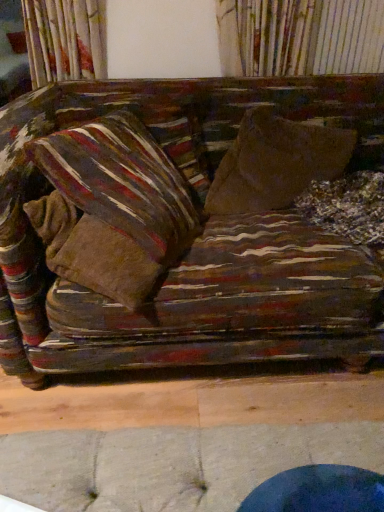
Question: Is striped fabric pillow at left, the 2th pillow when ordered from back to front, taller than striped fabric pillow at upper left, arranged as the first pillow when viewed from the back?

Choices:
 (A) yes
 (B) no

Answer: (A)

Question: Can you confirm if striped fabric pillow at left, the 1th pillow viewed from the front, is wider than striped fabric pillow at upper left, the 2th pillow positioned from the front?

Choices:
 (A) no
 (B) yes

Answer: (A)

Question: Is striped fabric pillow at left, the 2th pillow when ordered from back to front, next to striped fabric pillow at upper left, the 2th pillow positioned from the front, and touching it?

Choices:
 (A) no
 (B) yes

Answer: (A)

Question: From a real-world perspective, is striped fabric pillow at left, the 2th pillow when ordered from back to front, located higher than striped fabric pillow at upper left, the 2th pillow positioned from the front?

Choices:
 (A) no
 (B) yes

Answer: (B)

Question: Is striped fabric pillow at left, the 2th pillow when ordered from back to front, facing away from striped fabric pillow at upper left, arranged as the first pillow when viewed from the back?

Choices:
 (A) no
 (B) yes

Answer: (B)

Question: Considering the relative sizes of striped fabric pillow at left, the 1th pillow viewed from the front, and striped fabric pillow at upper left, arranged as the first pillow when viewed from the back, in the image provided, is striped fabric pillow at left, the 1th pillow viewed from the front, shorter than striped fabric pillow at upper left, arranged as the first pillow when viewed from the back,?

Choices:
 (A) yes
 (B) no

Answer: (B)

Question: Is brown fabric throw pillow at center positioned before striped fabric pillow at left, the 2th pillow when ordered from back to front?

Choices:
 (A) yes
 (B) no

Answer: (B)

Question: Does brown fabric throw pillow at center have a greater height compared to striped fabric pillow at left, the 2th pillow when ordered from back to front?

Choices:
 (A) no
 (B) yes

Answer: (A)

Question: From a real-world perspective, is brown fabric throw pillow at center under striped fabric pillow at left, the 2th pillow when ordered from back to front?

Choices:
 (A) yes
 (B) no

Answer: (A)

Question: Is brown fabric throw pillow at center behind striped fabric pillow at left, the 1th pillow viewed from the front?

Choices:
 (A) yes
 (B) no

Answer: (A)

Question: From the image's perspective, is brown fabric throw pillow at center over striped fabric pillow at left, the 1th pillow viewed from the front?

Choices:
 (A) no
 (B) yes

Answer: (B)

Question: From a real-world perspective, is brown fabric throw pillow at center located higher than striped fabric pillow at left, the 2th pillow when ordered from back to front?

Choices:
 (A) yes
 (B) no

Answer: (B)

Question: Is striped fabric pillow at left, the 1th pillow viewed from the front, to the left of brown fabric throw pillow at center from the viewer's perspective?

Choices:
 (A) yes
 (B) no

Answer: (A)